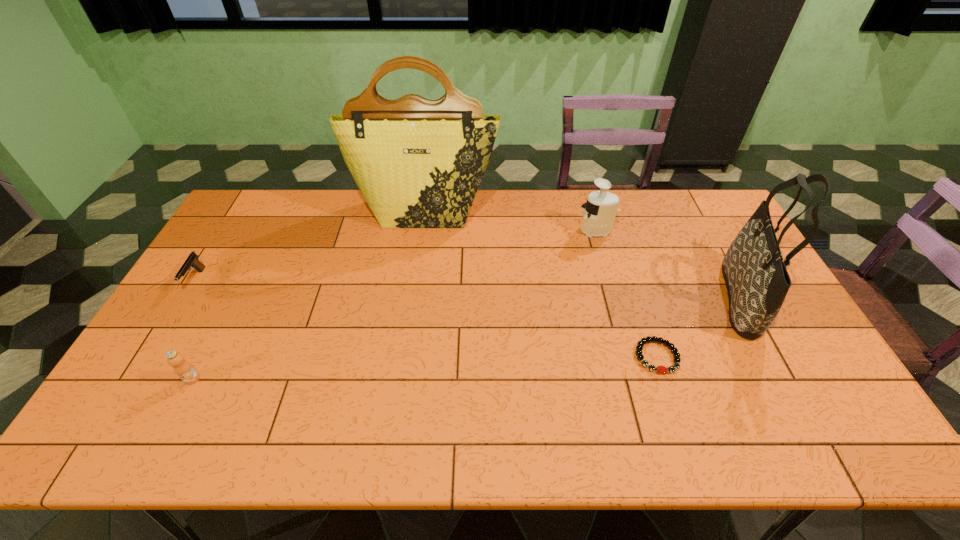
Where is `the left tote bag`? The image size is (960, 540). the left tote bag is located at coordinates (418, 163).

Find the location of a particular element. The width and height of the screenshot is (960, 540). the taller tote bag is located at coordinates (418, 163).

This screenshot has width=960, height=540. I want to click on the right tote bag, so click(x=757, y=281).

This screenshot has height=540, width=960. Identify the location of the rightmost object. (757, 281).

You are a GUI agent. You are given a task and a screenshot of the screen. Output one action in this format:
    pyautogui.click(x=<x>, y=<y>)
    Task: Click on the fourth shortest object
    The height and width of the screenshot is (540, 960).
    Given the screenshot: What is the action you would take?
    pyautogui.click(x=600, y=209)

Find the location of a particular element. the fourth tallest object is located at coordinates (182, 368).

Image resolution: width=960 pixels, height=540 pixels. I want to click on the second object from left to right, so [182, 368].

Find the location of a particular element. The image size is (960, 540). the leftmost object is located at coordinates (192, 261).

Where is `pistol`? This screenshot has width=960, height=540. pistol is located at coordinates (192, 261).

Where is `bracelet`? bracelet is located at coordinates (660, 369).